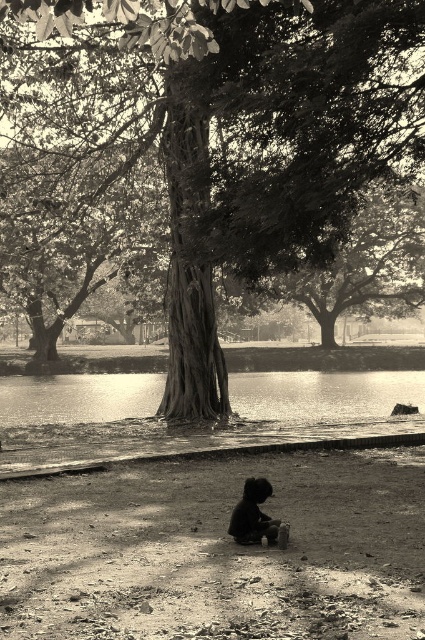
Question: Considering the relative positions of glistening water at center and dark skin child at center in the image provided, where is glistening water at center located with respect to dark skin child at center?

Choices:
 (A) right
 (B) left

Answer: (A)

Question: Which point is closer to the camera?

Choices:
 (A) dark skin child at center
 (B) glistening water at center

Answer: (A)

Question: Which point is farther to the camera?

Choices:
 (A) smooth bark tree at center
 (B) dark skin child at center
 (C) sepia textured tree at center

Answer: (A)

Question: Does smooth bark tree at center appear on the left side of dark skin child at center?

Choices:
 (A) no
 (B) yes

Answer: (A)

Question: Does glistening water at center come behind dark skin child at center?

Choices:
 (A) yes
 (B) no

Answer: (A)

Question: Based on their relative distances, which object is nearer to the sepia textured tree at center?

Choices:
 (A) dark skin child at center
 (B) glistening water at center

Answer: (A)